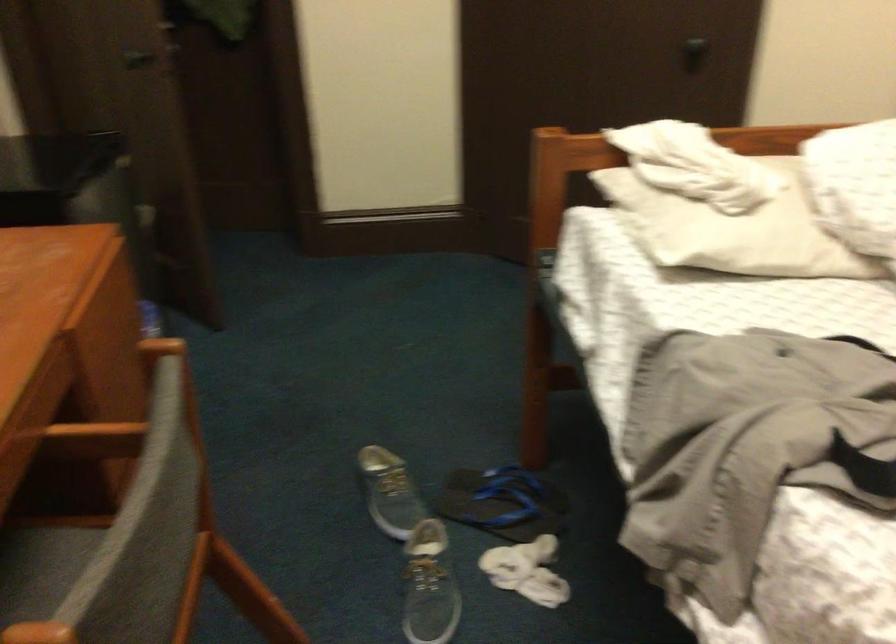
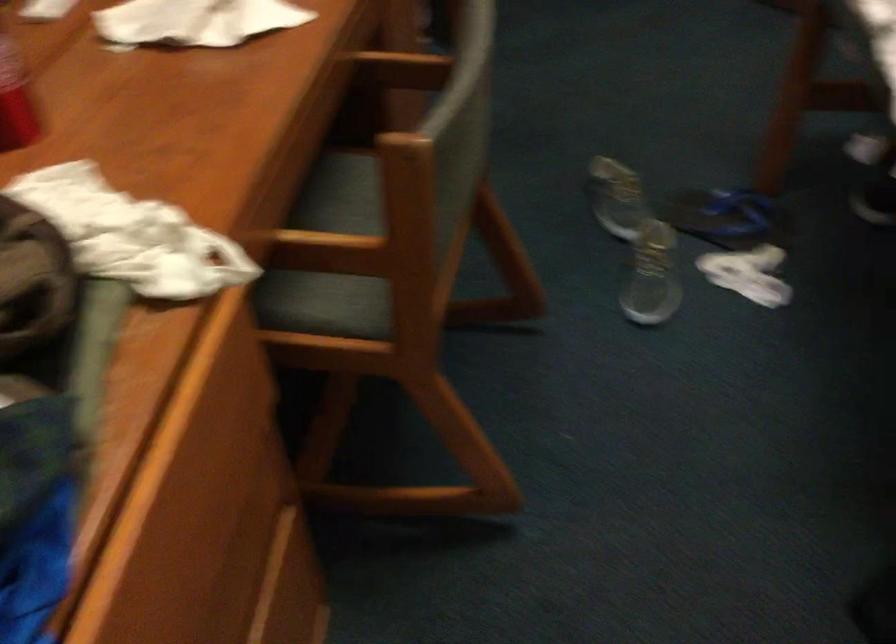
Where in the second image is the point corresponding to [106,446] from the first image?

(401, 69)